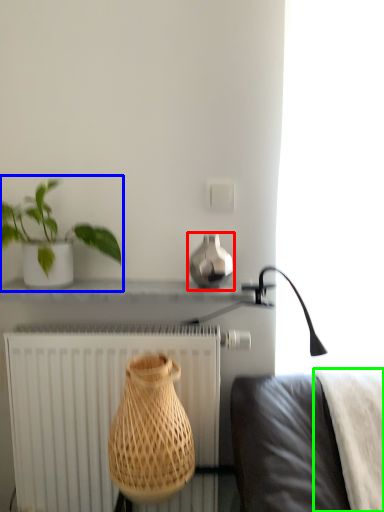
Question: Which object is the closest to the vase (highlighted by a red box)? Choose among these: houseplant (highlighted by a blue box) or blanket (highlighted by a green box).

Choices:
 (A) houseplant
 (B) blanket

Answer: (A)